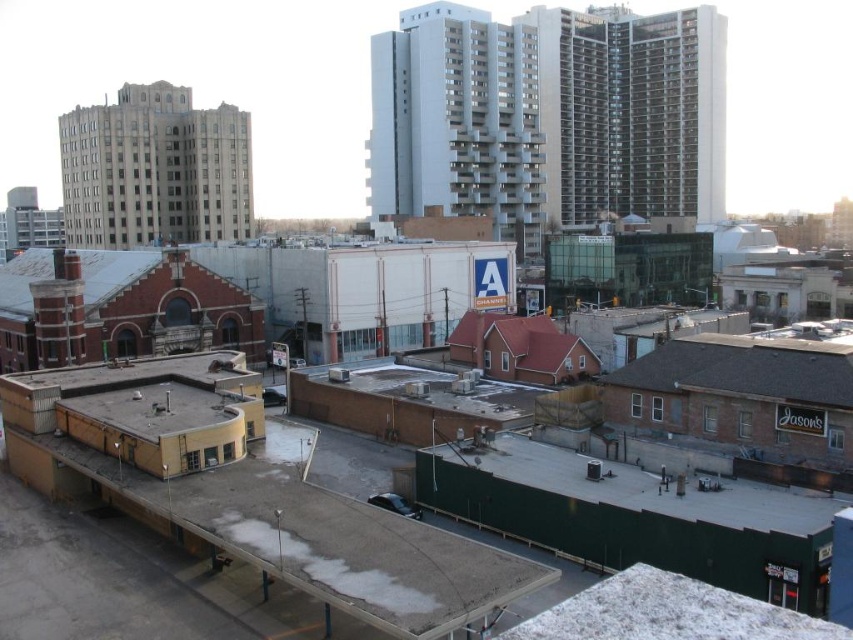
Question: Can you confirm if green matte wall at lower center is wider than brown shingles at lower right?

Choices:
 (A) no
 (B) yes

Answer: (B)

Question: Which of the following is the closest to the observer?

Choices:
 (A) coord(813,362)
 (B) coord(671,515)

Answer: (B)

Question: Does green matte wall at lower center lie in front of brown shingles at lower right?

Choices:
 (A) no
 (B) yes

Answer: (B)

Question: Which point is farther to the camera?

Choices:
 (A) green matte wall at lower center
 (B) brown shingles at lower right

Answer: (B)

Question: Considering the relative positions of green matte wall at lower center and brown shingles at lower right in the image provided, where is green matte wall at lower center located with respect to brown shingles at lower right?

Choices:
 (A) above
 (B) below

Answer: (B)

Question: Which point is closer to the camera?

Choices:
 (A) (824, 387)
 (B) (637, 500)

Answer: (B)